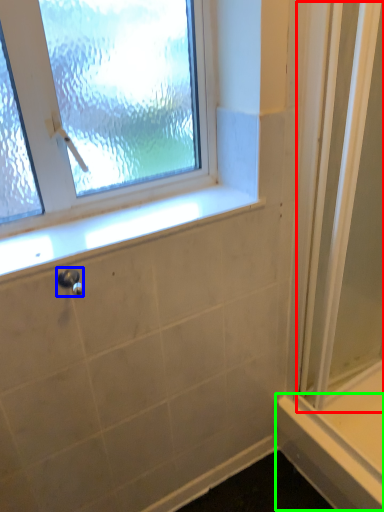
Question: Which object is the closest to the screen door (highlighted by a red box)? Choose among these: shower (highlighted by a blue box) or ledge (highlighted by a green box).

Choices:
 (A) shower
 (B) ledge

Answer: (B)